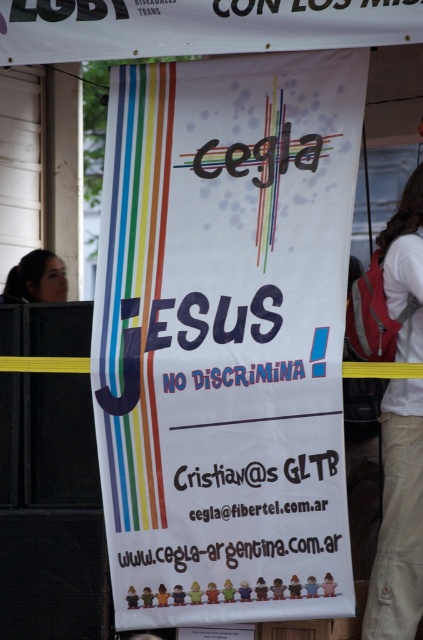
Based on the photo, which is more to the right, white paper banner at upper center or white cotton shirt at right?

white cotton shirt at right

Measure the distance between white paper banner at upper center and white cotton shirt at right.

white paper banner at upper center and white cotton shirt at right are 7.04 feet apart.

What do you see at coordinates (197, 26) in the screenshot? This screenshot has width=423, height=640. I see `white paper banner at upper center` at bounding box center [197, 26].

The width and height of the screenshot is (423, 640). Identify the location of white paper banner at upper center. (197, 26).

Does point (106, 1) lie in front of point (52, 253)?

Yes.

Does point (342, 44) come farther from viewer compared to point (25, 298)?

That is False.

Is point (392, 0) positioned before point (60, 300)?

Yes.

I want to click on white paper banner at upper center, so click(197, 26).

Is point (180, 557) positioned after point (60, 291)?

No, (180, 557) is in front of (60, 291).

Can you confirm if white paper banner at center is wider than matte black hair at left?

Correct, the width of white paper banner at center exceeds that of matte black hair at left.

Where is `white paper banner at center`? Image resolution: width=423 pixels, height=640 pixels. white paper banner at center is located at coordinates [x=225, y=337].